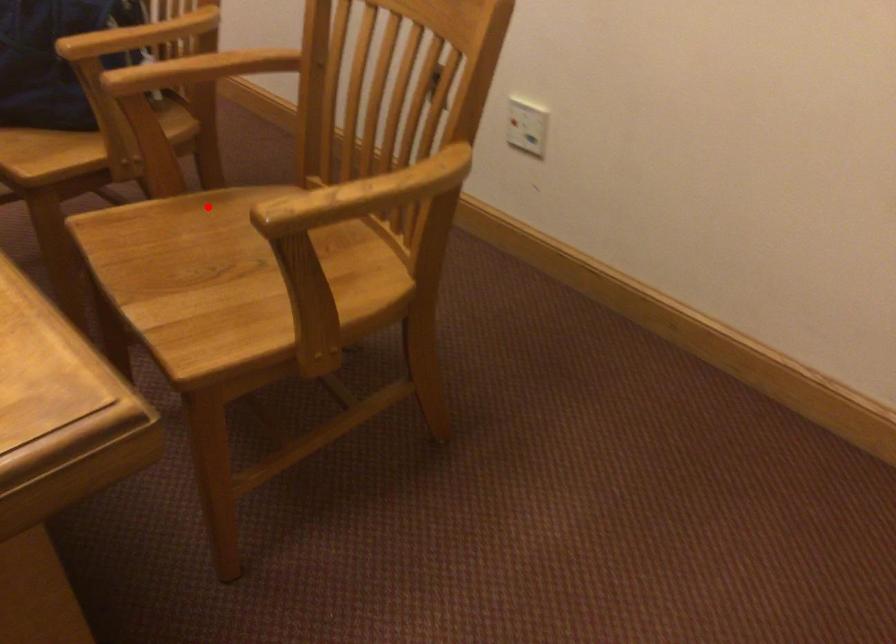
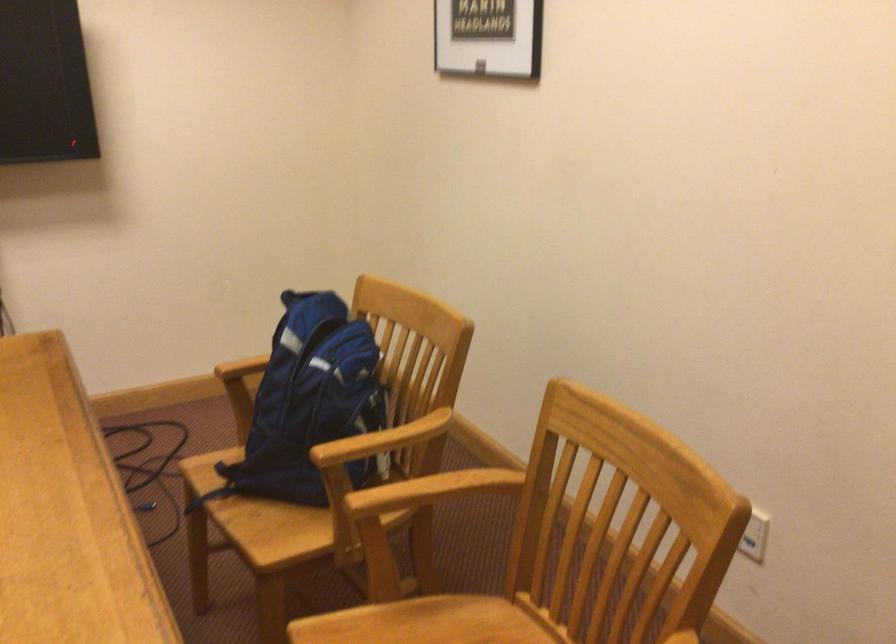
The point at the highlighted location is marked in the first image. Where is the corresponding point in the second image?

(415, 627)